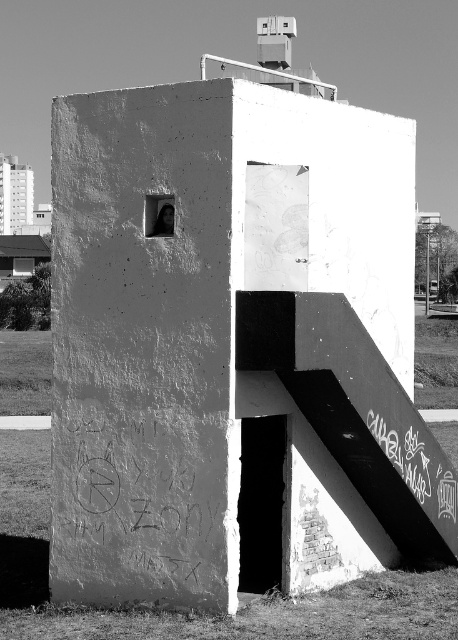
Question: Based on their relative distances, which object is nearer to the dark gray stone graffiti at center?

Choices:
 (A) matte black skateboard at upper center
 (B) graffiti chalk at lower right
 (C) smooth concrete stair at lower right

Answer: (A)

Question: Considering the real-world distances, which object is closest to the matte black skateboard at upper center?

Choices:
 (A) smooth concrete stair at lower right
 (B) dark gray stone graffiti at center
 (C) graffiti chalk at lower right

Answer: (B)

Question: Is graffiti chalk at lower right below matte black skateboard at upper center?

Choices:
 (A) no
 (B) yes

Answer: (B)

Question: Where is dark gray stone graffiti at center located in relation to matte black skateboard at upper center in the image?

Choices:
 (A) left
 (B) right

Answer: (A)

Question: Does dark gray stone graffiti at center appear over graffiti chalk at lower right?

Choices:
 (A) no
 (B) yes

Answer: (B)

Question: Which object is positioned farthest from the smooth concrete stair at lower right?

Choices:
 (A) matte black skateboard at upper center
 (B) dark gray stone graffiti at center
 (C) graffiti chalk at lower right

Answer: (A)